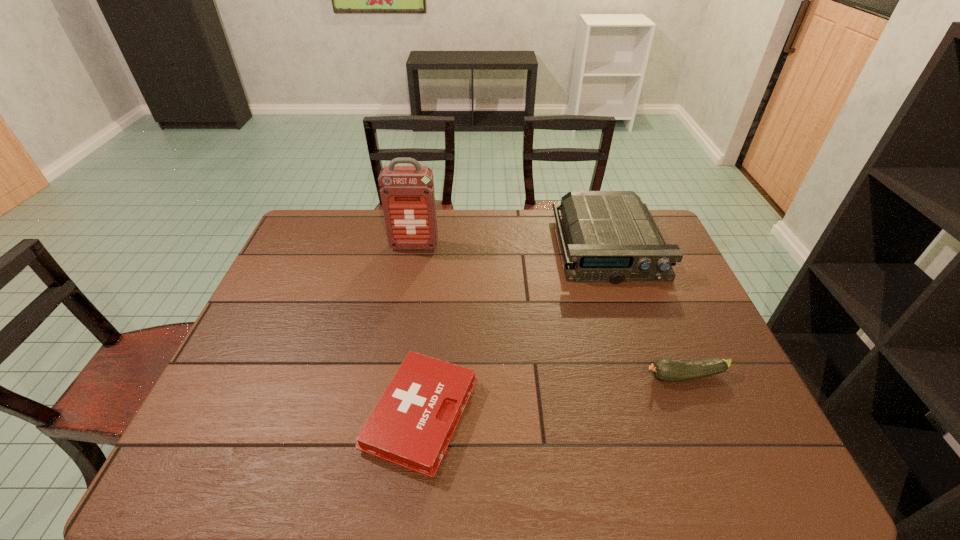
At what (x,y) coordinates should I click in order to perform the action: click on vacant position at the right edge of the desktop. Please return your answer as a coordinate pair (x, y). Looking at the image, I should click on (709, 414).

In the image, there is a desktop. Where is `vacant space at the far left corner`? vacant space at the far left corner is located at coordinates (348, 214).

Image resolution: width=960 pixels, height=540 pixels. In order to click on vacant area at the near left corner of the desktop in this screenshot , I will do `click(247, 458)`.

Where is `free spot at the near right corner of the desktop`? The width and height of the screenshot is (960, 540). free spot at the near right corner of the desktop is located at coordinates (728, 469).

Find the location of `blank region between the nearer first-aid kit and the second tallest object`. blank region between the nearer first-aid kit and the second tallest object is located at coordinates (515, 331).

At what (x,y) coordinates should I click in order to perform the action: click on free space between the nearer first-aid kit and the farther first-aid kit. Please return your answer as a coordinate pair (x, y). The height and width of the screenshot is (540, 960). Looking at the image, I should click on (418, 330).

Locate an element on the screen. This screenshot has height=540, width=960. free spot between the taller first-aid kit and the shorter first-aid kit is located at coordinates (418, 330).

Identify the location of vacant space that's between the taller first-aid kit and the zucchini. The height and width of the screenshot is (540, 960). (550, 311).

Find the location of a particular element. free area in between the taller first-aid kit and the zucchini is located at coordinates (550, 311).

Where is `empty space that is in between the shorter first-aid kit and the radio receiver`? Image resolution: width=960 pixels, height=540 pixels. empty space that is in between the shorter first-aid kit and the radio receiver is located at coordinates (515, 331).